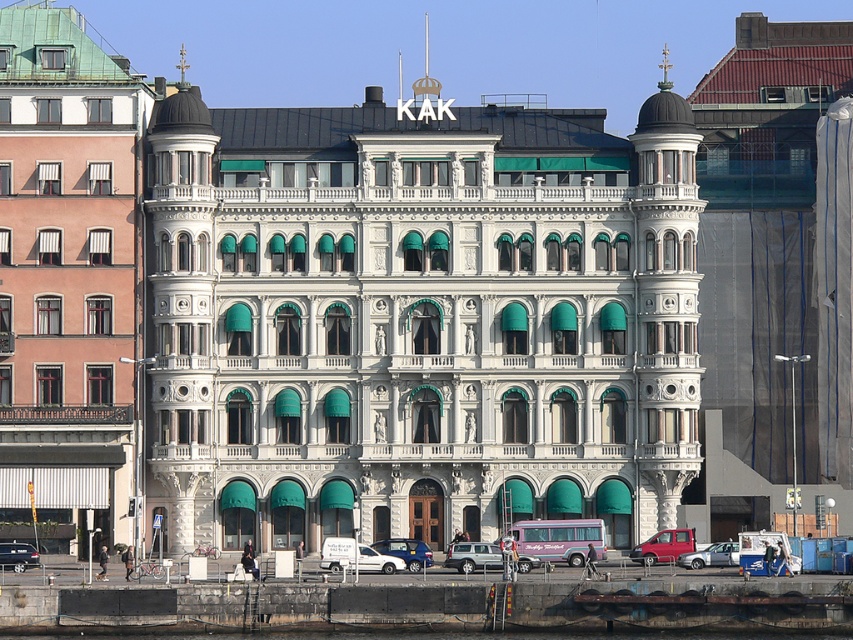
You are a delivery driver who needs to park your silver metallic sedan at lower center next to the metallic red van at lower right. Can you park your car without hitting the van?

The metallic red van at lower right is taller than the silver metallic sedan at lower center, so parking next to it should be possible without hitting the van as height is not an issue here.